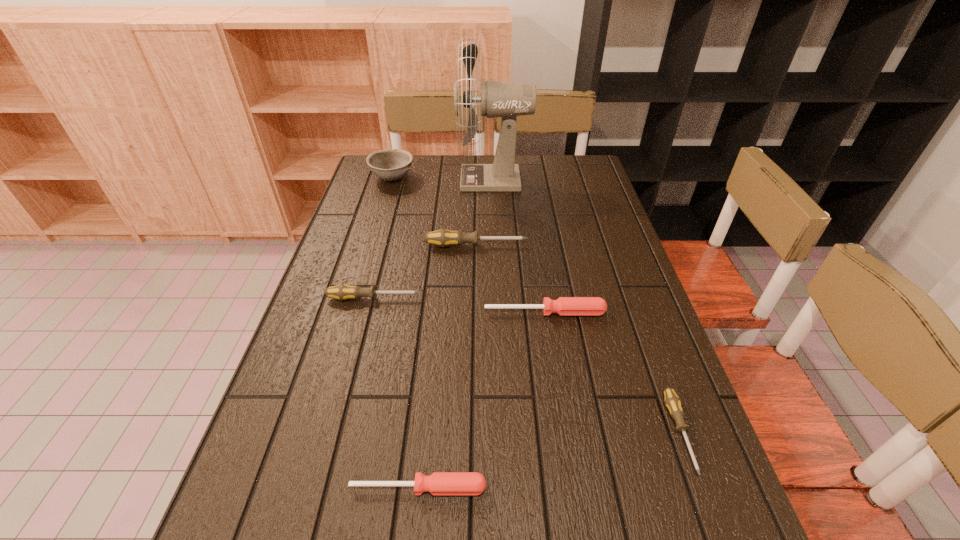
Where is `vacant space located on the back of the third farthest screwdriver`? Image resolution: width=960 pixels, height=540 pixels. vacant space located on the back of the third farthest screwdriver is located at coordinates (537, 256).

The width and height of the screenshot is (960, 540). Find the location of `vacant space situated 0.390m on the right of the nearer red screwdriver`. vacant space situated 0.390m on the right of the nearer red screwdriver is located at coordinates (707, 488).

Locate an element on the screen. The height and width of the screenshot is (540, 960). vacant space located at the tip of the rightmost screwdriver is located at coordinates [x=717, y=535].

Where is `fan that is at the far edge`? The height and width of the screenshot is (540, 960). fan that is at the far edge is located at coordinates (507, 100).

Locate an element on the screen. The image size is (960, 540). bowl situated at the far edge is located at coordinates (390, 164).

Locate an element on the screen. Image resolution: width=960 pixels, height=540 pixels. bowl situated at the left edge is located at coordinates (390, 164).

Image resolution: width=960 pixels, height=540 pixels. In order to click on screwdriver situated at the left edge in this screenshot , I will do `click(342, 292)`.

Find the location of `object present at the far left corner`. object present at the far left corner is located at coordinates (390, 164).

Where is `vacant region at the far edge of the desktop`? vacant region at the far edge of the desktop is located at coordinates (445, 170).

In the image, there is a desktop. At what (x,y) coordinates should I click in order to perform the action: click on free space at the left edge. Please return your answer as a coordinate pair (x, y). Looking at the image, I should click on (267, 429).